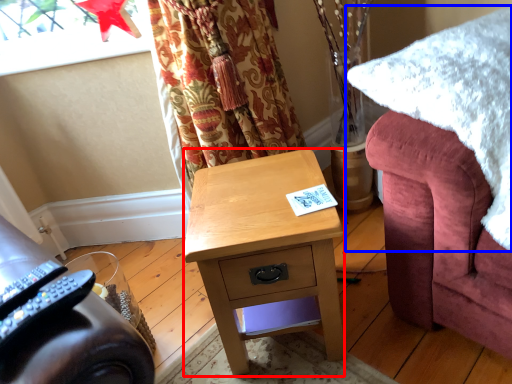
Question: Which object appears closest to the camera in this image, desk (highlighted by a red box) or blanket (highlighted by a blue box)?

Choices:
 (A) desk
 (B) blanket

Answer: (B)